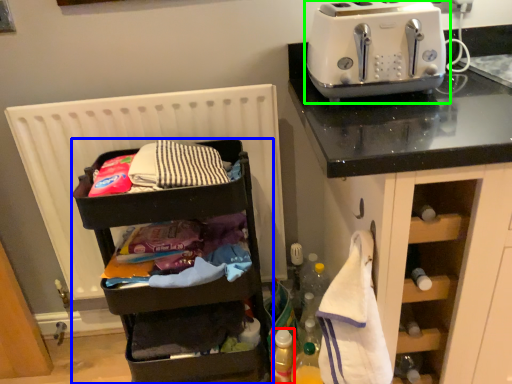
Question: Based on their relative distances, which object is nearer to bottle (highlighted by a red box)? Choose from shelf (highlighted by a blue box) and toaster (highlighted by a green box).

Choices:
 (A) shelf
 (B) toaster

Answer: (A)